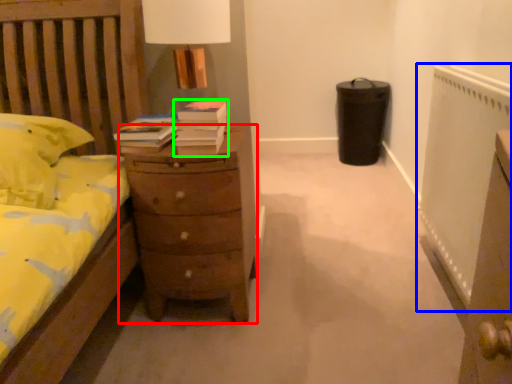
Question: Which object is the farthest from chest of drawers (highlighted by a red box)? Choose among these: radiator (highlighted by a blue box) or book (highlighted by a green box).

Choices:
 (A) radiator
 (B) book

Answer: (A)